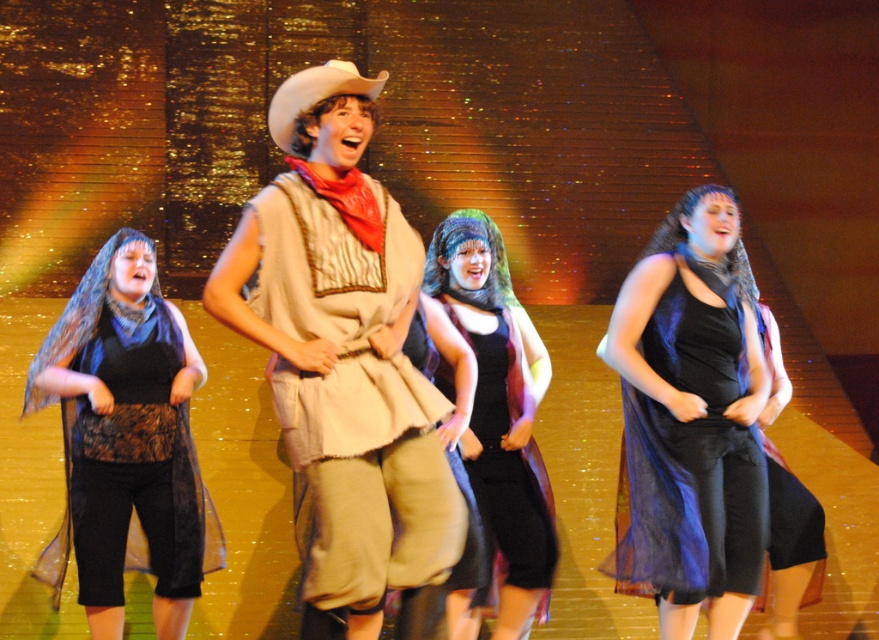
Who is taller, rustic burlap vest at center or black velvet dress at center?

With more height is rustic burlap vest at center.

Measure the distance between rustic burlap vest at center and camera.

11.29 feet

Who is more forward, [338,502] or [510,568]?

Point [338,502] is in front.

The width and height of the screenshot is (879, 640). I want to click on rustic burlap vest at center, so click(345, 362).

Find the location of a particular element. This screenshot has height=640, width=879. rustic burlap vest at center is located at coordinates (345, 362).

Looking at this image, does rustic burlap vest at center have a greater width compared to black sheer scarf at left?

In fact, rustic burlap vest at center might be narrower than black sheer scarf at left.

Which is in front, point (408, 531) or point (151, 365)?

Point (408, 531) is more forward.

At what (x,y) coordinates should I click in order to perform the action: click on rustic burlap vest at center. Please return your answer as a coordinate pair (x, y). The width and height of the screenshot is (879, 640). Looking at the image, I should click on (345, 362).

Who is more distant from viewer, (725,292) or (186,586)?

Point (186,586)

At what (x,y) coordinates should I click in order to perform the action: click on black sheer dress at center. Please return your answer as a coordinate pair (x, y). This screenshot has height=640, width=879. Looking at the image, I should click on (692, 417).